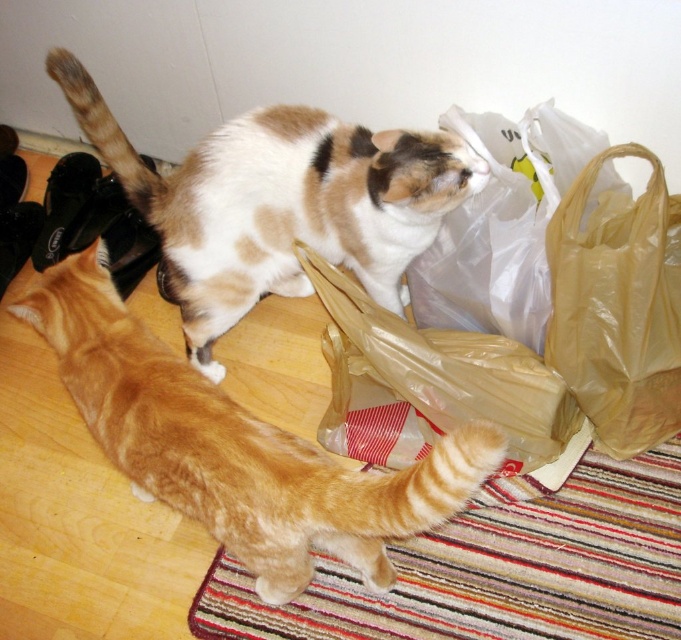
Does calico fur cat at upper center appear on the left side of matte yellow plastic bag at right?

Correct, you'll find calico fur cat at upper center to the left of matte yellow plastic bag at right.

This screenshot has width=681, height=640. What do you see at coordinates (279, 204) in the screenshot?
I see `calico fur cat at upper center` at bounding box center [279, 204].

Does point (477, 166) lie behind point (629, 209)?

That is True.

Find the location of a particular element. The image size is (681, 640). calico fur cat at upper center is located at coordinates (279, 204).

Does calico fur cat at upper center appear on the right side of translucent plastic bag at center?

No, calico fur cat at upper center is not to the right of translucent plastic bag at center.

Does point (268, 164) come closer to viewer compared to point (506, 339)?

Yes, point (268, 164) is in front of point (506, 339).

This screenshot has width=681, height=640. What do you see at coordinates (279, 204) in the screenshot?
I see `calico fur cat at upper center` at bounding box center [279, 204].

Where is `calico fur cat at upper center`? The width and height of the screenshot is (681, 640). calico fur cat at upper center is located at coordinates (279, 204).

Is point (360, 358) closer to viewer compared to point (669, 346)?

No, it is not.

Which is below, translucent plastic bag at center or matte yellow plastic bag at right?

translucent plastic bag at center is lower down.

Locate an element on the screen. translucent plastic bag at center is located at coordinates (434, 387).

The height and width of the screenshot is (640, 681). Identify the location of translucent plastic bag at center. (434, 387).